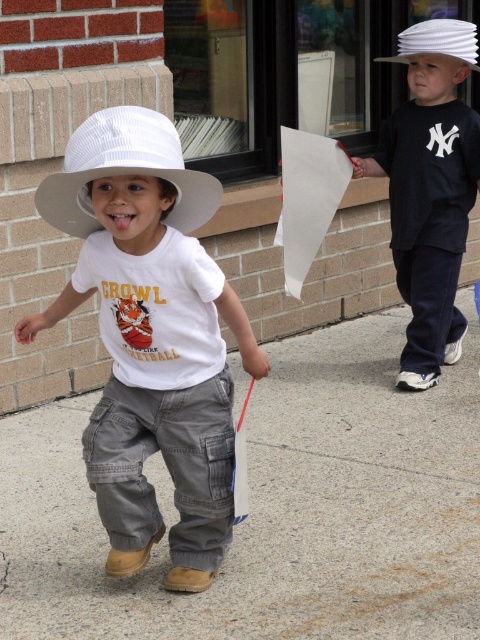
You are a photographer trying to capture both the gray concrete pavement at center and the white straw hat at left in a single shot. Which object should you focus on first to ensure both are in frame?

The gray concrete pavement at center is bigger than the white straw hat at left, so you should focus on the white straw hat at left first to ensure both fit within the frame.

You are a delivery drone that is 0.5 meters wide. You need to fly from the matte white hat at left to the gray concrete pavement at center. Is there enough space for you to pass through the area between them?

→ The distance between matte white hat at left and gray concrete pavement at center is 1.23 meters. Since the drone is 0.5 meters wide, it can easily pass through the space between them as the distance is sufficient.